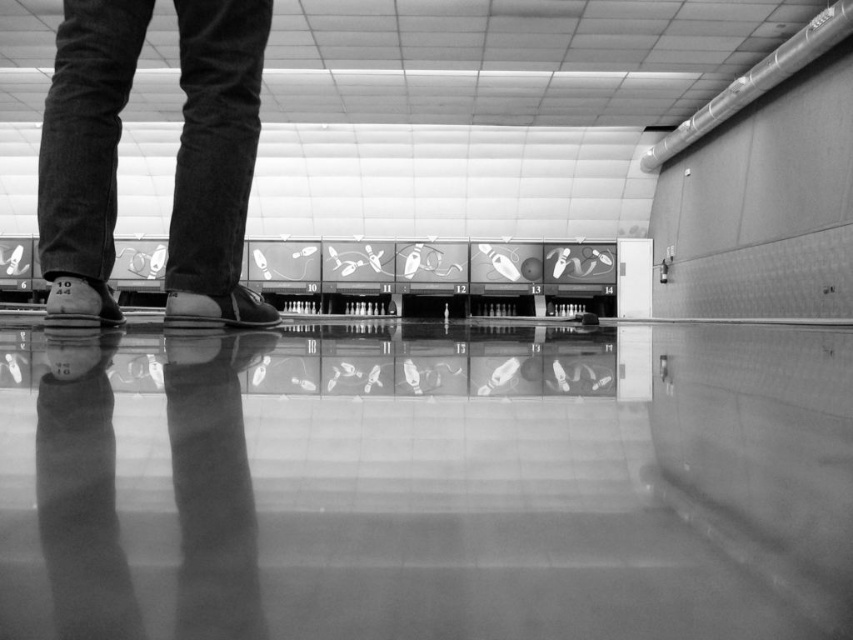
Question: Does leather shoe at center lie in front of leather at left?

Choices:
 (A) yes
 (B) no

Answer: (B)

Question: Does dark gray suede shoes at center have a smaller size compared to leather shoe at center?

Choices:
 (A) yes
 (B) no

Answer: (B)

Question: Which point is farther from the camera taking this photo?

Choices:
 (A) (78, 280)
 (B) (212, 323)

Answer: (B)

Question: Which point is farther to the camera?

Choices:
 (A) (248, 188)
 (B) (86, 296)

Answer: (A)

Question: Among these points, which one is farthest from the camera?

Choices:
 (A) (177, 236)
 (B) (62, 316)
 (C) (260, 312)

Answer: (C)

Question: Does dark gray suede shoes at center have a smaller size compared to leather at left?

Choices:
 (A) yes
 (B) no

Answer: (B)